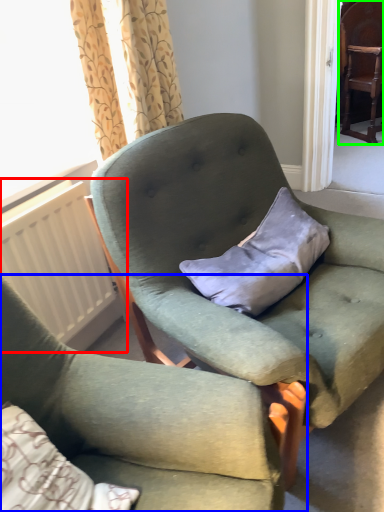
Question: Which object is the farthest from radiator (highlighted by a red box)? Choose among these: chair (highlighted by a blue box) or chair (highlighted by a green box).

Choices:
 (A) chair
 (B) chair

Answer: (B)